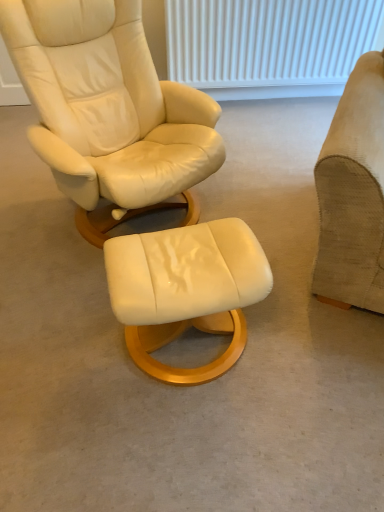
You are a GUI agent. You are given a task and a screenshot of the screen. Output one action in this format:
    pyautogui.click(x=<x>, y=<y>)
    Task: Click on the vacant area that is in front of white textured radiator at upper center
    Image resolution: width=384 pixels, height=512 pixels.
    Given the screenshot: What is the action you would take?
    pyautogui.click(x=271, y=143)